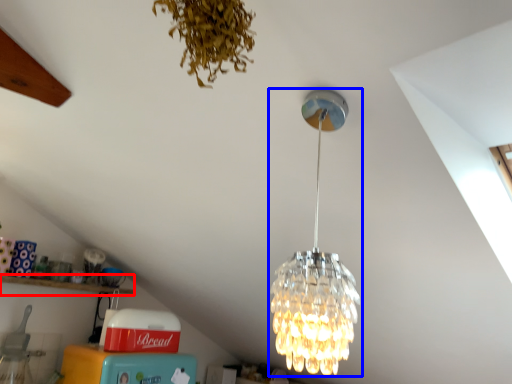
Question: Which object appears closest to the camera in this image, shelf (highlighted by a red box) or lamp (highlighted by a blue box)?

Choices:
 (A) shelf
 (B) lamp

Answer: (B)